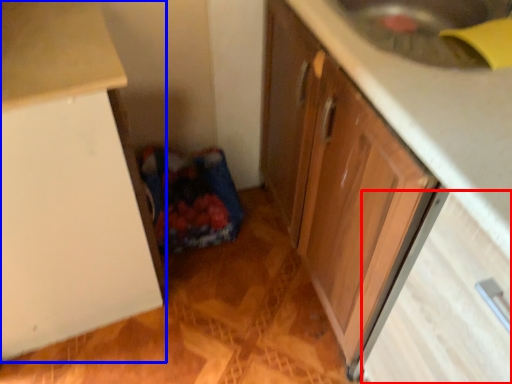
Question: Which of the following is the farthest to the observer, drawer (highlighted by a red box) or cabinetry (highlighted by a blue box)?

Choices:
 (A) drawer
 (B) cabinetry

Answer: (B)